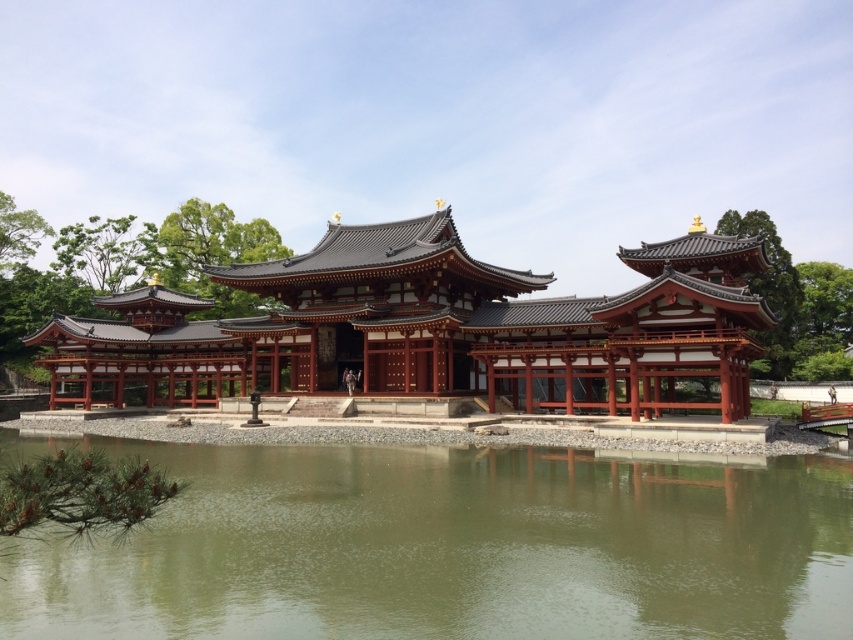
Is point (730, 544) positioned in front of point (335, 266)?

Yes, point (730, 544) is in front of point (335, 266).

Which is behind, point (844, 548) or point (277, 321)?

Positioned behind is point (277, 321).

At what (x,y) coordinates should I click in order to perform the action: click on green reflective water at center. Please return your answer as a coordinate pair (x, y). This screenshot has width=853, height=640. Looking at the image, I should click on tap(451, 548).